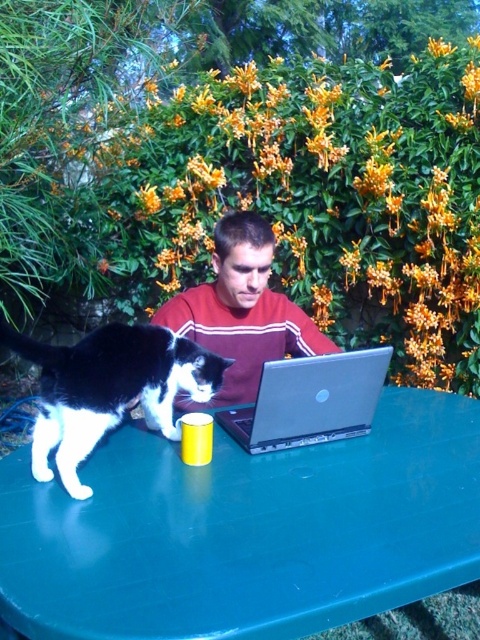
Can you confirm if black and white fur cat at left is positioned below silver metallic laptop at center?

Actually, black and white fur cat at left is above silver metallic laptop at center.

Is point (99, 380) positioned after point (289, 362)?

No, it is in front of (289, 362).

The height and width of the screenshot is (640, 480). In order to click on black and white fur cat at left in this screenshot , I will do `click(108, 388)`.

Who is positioned more to the left, green plastic table at center or silver metallic laptop at center?

green plastic table at center

What are the coordinates of `green plastic table at center` in the screenshot? It's located at (245, 531).

This screenshot has height=640, width=480. In order to click on green plastic table at center in this screenshot , I will do `click(245, 531)`.

The image size is (480, 640). Identify the location of green plastic table at center. (245, 531).

Is black and white fur cat at left wider than maroon sweater at center?

No, black and white fur cat at left is not wider than maroon sweater at center.

Does black and white fur cat at left appear on the left side of maroon sweater at center?

Correct, you'll find black and white fur cat at left to the left of maroon sweater at center.

Is point (107, 365) positioned before point (260, 256)?

Yes, it is in front of point (260, 256).

Image resolution: width=480 pixels, height=640 pixels. Find the location of `black and white fur cat at left`. black and white fur cat at left is located at coordinates (108, 388).